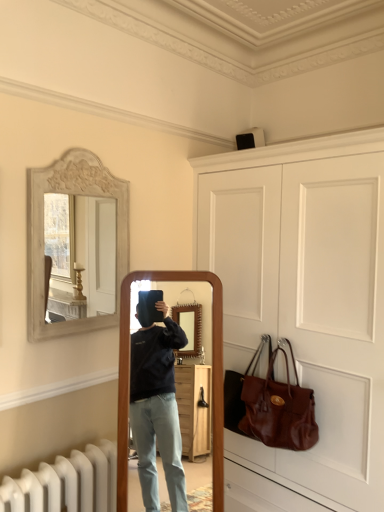
Question: Does white carved wood mirror at upper left have a larger size compared to white matte door at upper center?

Choices:
 (A) no
 (B) yes

Answer: (A)

Question: Can you confirm if white carved wood mirror at upper left is smaller than white matte door at upper center?

Choices:
 (A) no
 (B) yes

Answer: (B)

Question: Can you confirm if white carved wood mirror at upper left is positioned to the right of white matte door at upper center?

Choices:
 (A) no
 (B) yes

Answer: (A)

Question: From a real-world perspective, is white carved wood mirror at upper left on white matte door at upper center?

Choices:
 (A) no
 (B) yes

Answer: (B)

Question: Could white matte door at upper center be considered to be inside white carved wood mirror at upper left?

Choices:
 (A) no
 (B) yes

Answer: (A)

Question: Considering the relative sizes of white carved wood mirror at upper left and white matte door at upper center in the image provided, is white carved wood mirror at upper left shorter than white matte door at upper center?

Choices:
 (A) yes
 (B) no

Answer: (A)

Question: From the image's perspective, does white carved wood mirror at upper left appear lower than brown leather handbag at lower right?

Choices:
 (A) yes
 (B) no

Answer: (B)

Question: Is white carved wood mirror at upper left closer to the viewer compared to brown leather handbag at lower right?

Choices:
 (A) yes
 (B) no

Answer: (A)

Question: From the image's perspective, is white carved wood mirror at upper left over brown leather handbag at lower right?

Choices:
 (A) no
 (B) yes

Answer: (B)

Question: Is white carved wood mirror at upper left turned away from brown leather handbag at lower right?

Choices:
 (A) no
 (B) yes

Answer: (A)

Question: Is white carved wood mirror at upper left further to camera compared to brown leather handbag at lower right?

Choices:
 (A) yes
 (B) no

Answer: (B)

Question: Is white carved wood mirror at upper left to the right of brown leather handbag at lower right from the viewer's perspective?

Choices:
 (A) no
 (B) yes

Answer: (A)

Question: Is the position of white matte door at upper center more distant than that of white carved wood mirror at upper left?

Choices:
 (A) no
 (B) yes

Answer: (A)